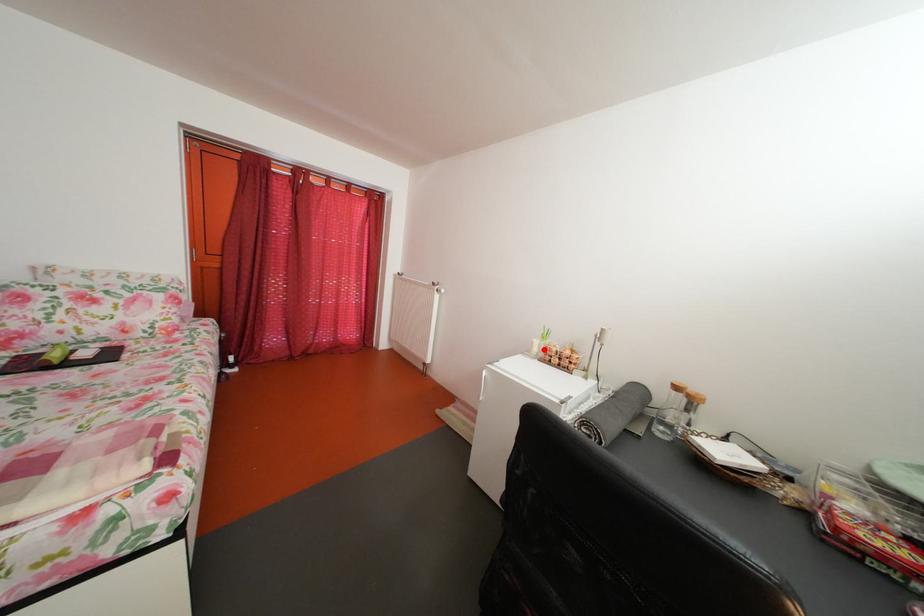
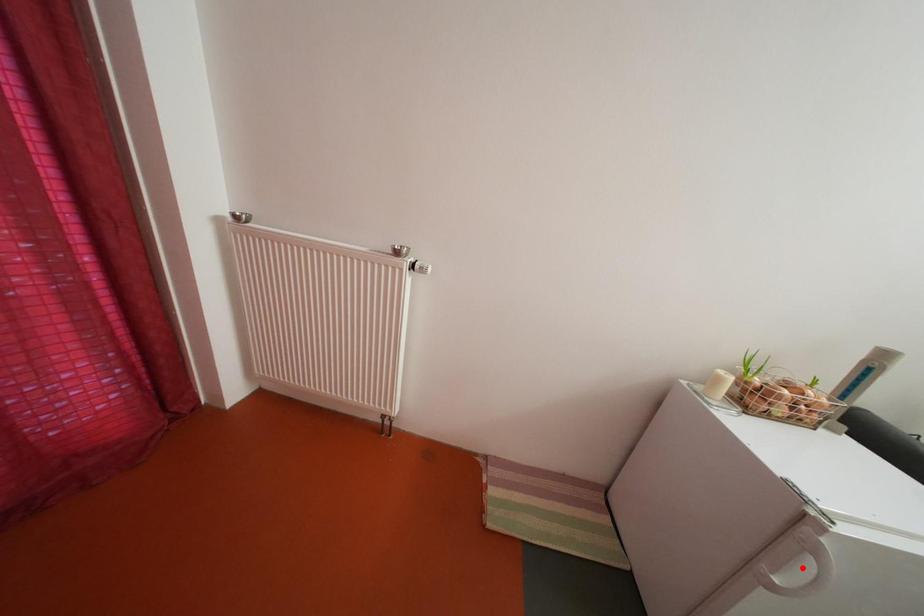
I am providing you with two images of the same scene from different viewpoints. A red point is marked on the first image and another point is marked on the second image. Is the red point in image1 aligned with the point shown in image2?

No